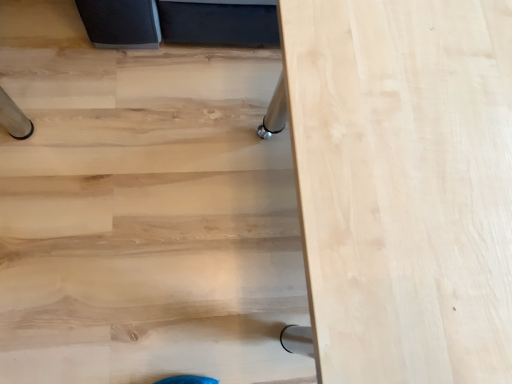
Find the location of a particular element. The height and width of the screenshot is (384, 512). vacant area on top of light wood table at lower right (from a real-world perspective) is located at coordinates (176, 185).